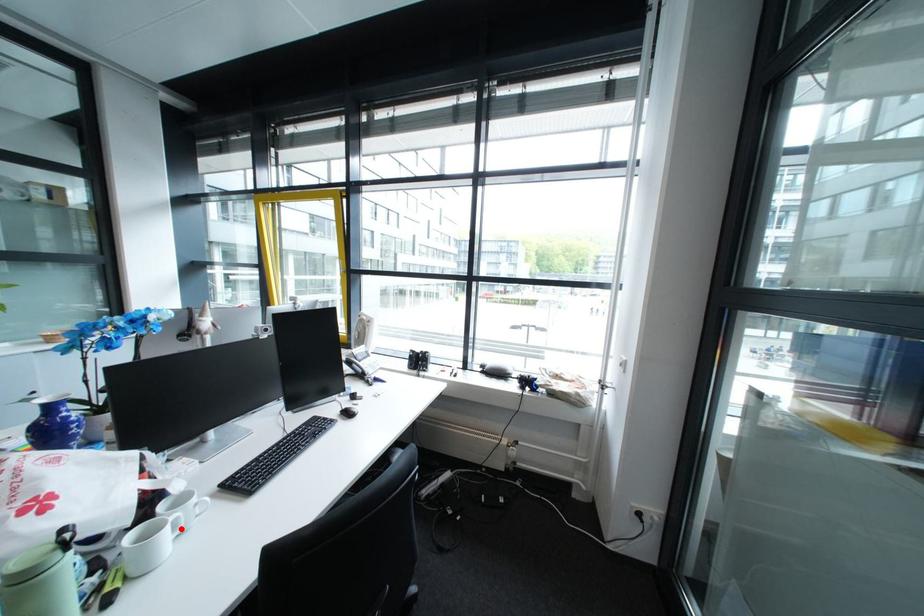
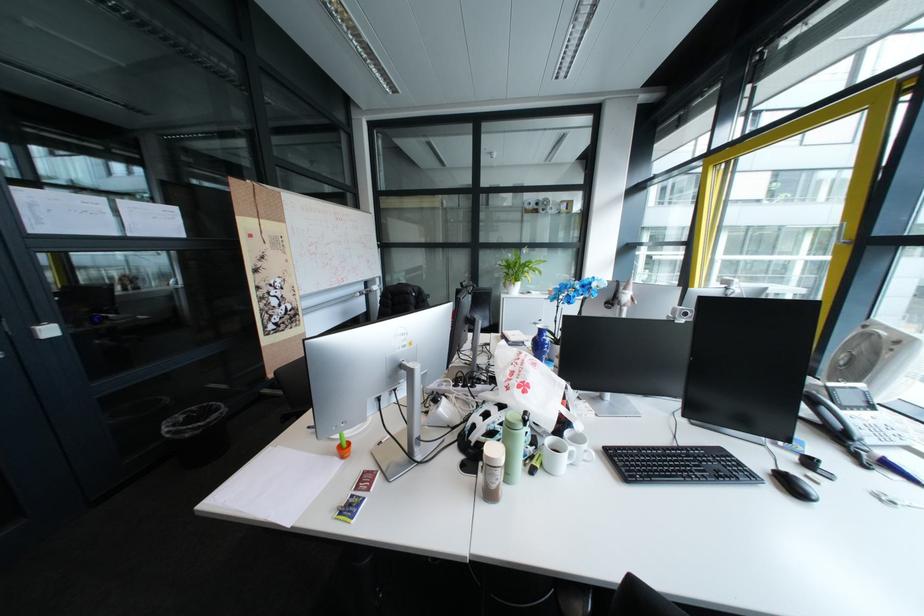
Find the pixel in the second image that matches the highlighted location in the first image.

(580, 455)